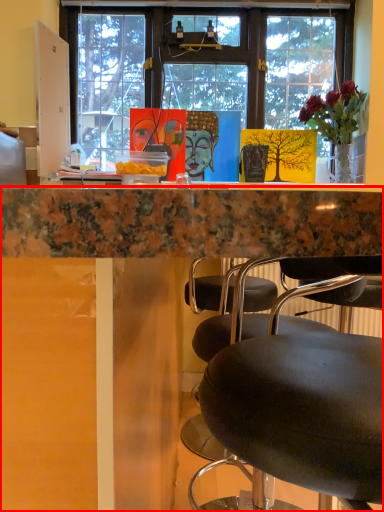
Question: From the image, what is the correct spatial relationship of desk (annotated by the red box) in relation to houseplant?

Choices:
 (A) right
 (B) left

Answer: (B)